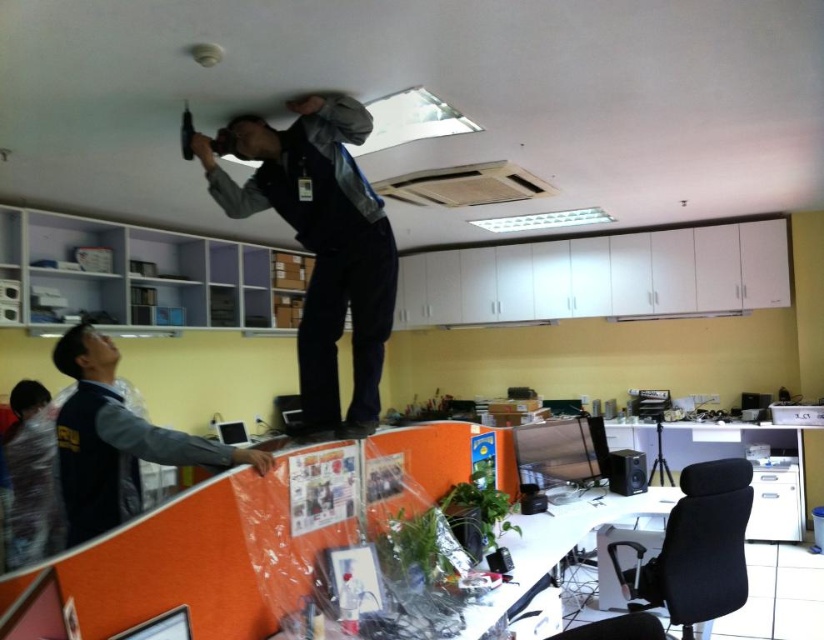
You are an office cleaner who needs to move the gray fabric jacket at upper center and the matte black computer at upper center to clean the area behind them. Based on their positions, which object should you move first to access the area behind both?

The gray fabric jacket at upper center should be moved first because it might be wider than the matte black computer at upper center, making it an obstruction closer to the area you need to access.

You are a maintenance worker in an office. You need to reach a tool located at the gray fabric jacket at upper center. The tool is on a high shelf. Can you safely reach it without a ladder?

The gray fabric jacket at upper center is 2.41 meters away from camera. Since the distance is horizontal, not vertical, the height of the shelf isnnt specified. Without knowing the shelf height, it is impossible to determine if you can reach the tool safely.

You are an office worker who needs to identify the person wearing the gray fabric jacket at upper center. Based on their position relative to the blue fabric jacket at lower left, where would you find them?

The gray fabric jacket at upper center is taller than the blue fabric jacket at lower left, so the person wearing the gray fabric jacket at upper center would be positioned higher up, likely on the desk or elevated surface compared to the blue fabric jacket at lower left who is on the floor.